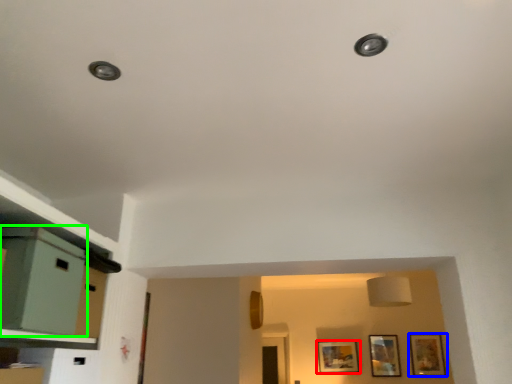
Question: Estimate the real-world distances between objects in this image. Which object is closer to picture frame (highlighted by a red box), picture frame (highlighted by a blue box) or file cabinet (highlighted by a green box)?

Choices:
 (A) picture frame
 (B) file cabinet

Answer: (A)